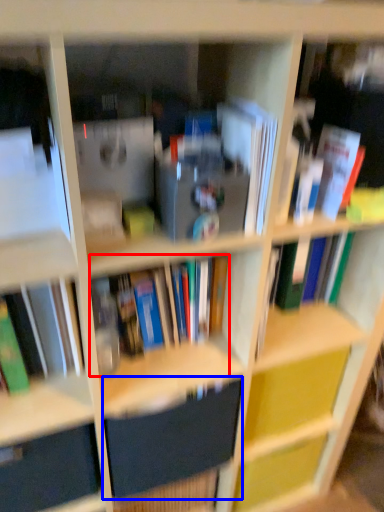
Question: Which point is further to the camera, book (highlighted by a red box) or paperback book (highlighted by a blue box)?

Choices:
 (A) book
 (B) paperback book

Answer: (B)